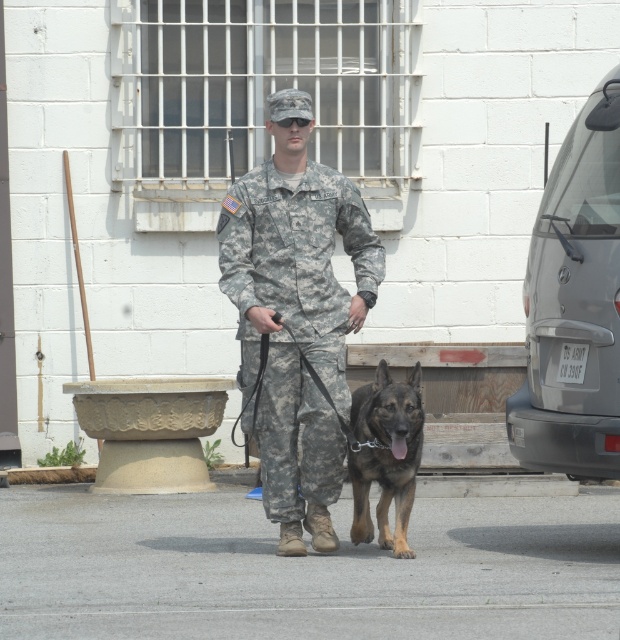
You are a security guard observing the scene. The soldier in camouflage uniform at center is walking with the brown fur dog at center. Which one is closer to you?

The camouflage uniform at center is closer to you because it is in front of the brown fur dog at center.

You are a photographer setting up a shot of the soldier and the dog. You need to ensure that both subjects are clearly visible in the frame. Given that the camouflage uniform at center is larger than the brown fur dog at center, where should you position the camera to capture both effectively?

Since the camouflage uniform at center is larger than the brown fur dog at center, position the camera slightly higher to ensure both the larger camouflage uniform at center and the smaller brown fur dog at center are fully visible in the frame.